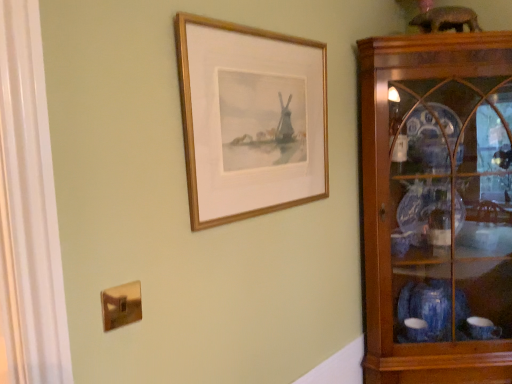
Question: In the image, is gold wood picture frame at upper center positioned in front of or behind wooden cabinet at right?

Choices:
 (A) behind
 (B) front

Answer: (B)

Question: In terms of width, does gold wood picture frame at upper center look wider or thinner when compared to wooden cabinet at right?

Choices:
 (A) thin
 (B) wide

Answer: (A)

Question: From their relative heights in the image, would you say gold wood picture frame at upper center is taller or shorter than wooden cabinet at right?

Choices:
 (A) tall
 (B) short

Answer: (B)

Question: Is wooden cabinet at right situated inside gold wood picture frame at upper center or outside?

Choices:
 (A) outside
 (B) inside

Answer: (A)

Question: From a real-world perspective, is wooden cabinet at right positioned above or below gold wood picture frame at upper center?

Choices:
 (A) above
 (B) below

Answer: (B)

Question: Considering the positions of wooden cabinet at right and gold wood picture frame at upper center in the image, is wooden cabinet at right bigger or smaller than gold wood picture frame at upper center?

Choices:
 (A) small
 (B) big

Answer: (B)

Question: Is point (434, 377) closer or farther from the camera than point (246, 162)?

Choices:
 (A) farther
 (B) closer

Answer: (A)